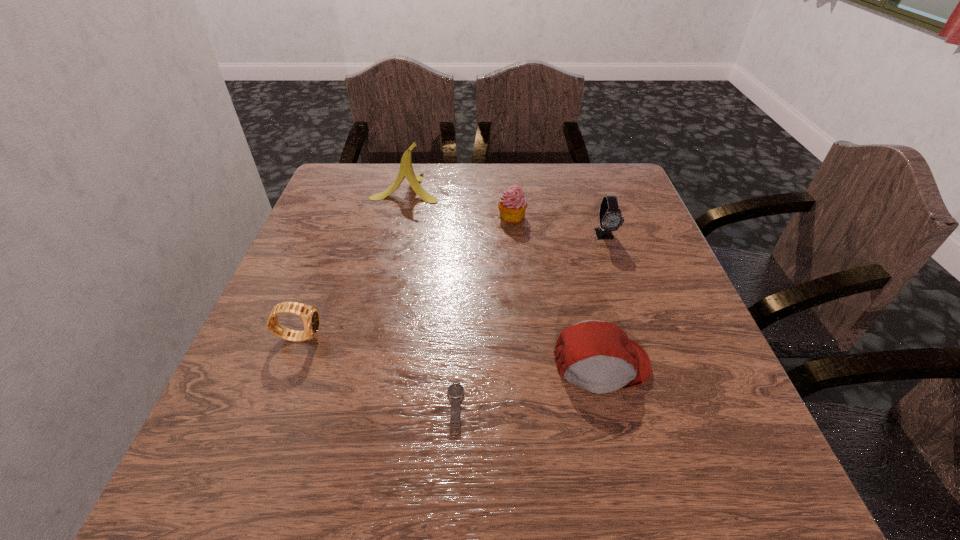
In order to click on vacant space positioned 0.250m on the front of the fifth object from right to left in this screenshot , I will do `click(388, 267)`.

This screenshot has height=540, width=960. What are the coordinates of `vacant space located on the face of the rightmost watch` in the screenshot? It's located at (623, 290).

In order to click on blank area located 0.130m on the back of the cupcake in this screenshot , I will do `click(509, 182)`.

At what (x,y) coordinates should I click in order to perform the action: click on vacant space located on the face of the second farthest watch. Please return your answer as a coordinate pair (x, y). Looking at the image, I should click on (353, 336).

The width and height of the screenshot is (960, 540). I want to click on free space located on the front-facing side of the cap, so click(637, 512).

I want to click on vacant space located on the back of the shortest watch, so click(461, 283).

Identify the location of banana present at the far edge. (406, 170).

At what (x,y) coordinates should I click in order to perform the action: click on cupcake situated at the far edge. Please return your answer as a coordinate pair (x, y). This screenshot has height=540, width=960. Looking at the image, I should click on (512, 206).

At what (x,y) coordinates should I click in order to perform the action: click on banana located at the left edge. Please return your answer as a coordinate pair (x, y). Image resolution: width=960 pixels, height=540 pixels. Looking at the image, I should click on (406, 170).

Find the location of a particular element. The image size is (960, 540). watch situated at the left edge is located at coordinates (310, 316).